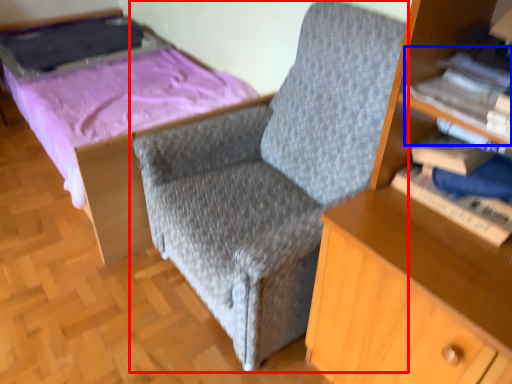
Question: Which of the following is the closest to the observer, chair (highlighted by a red box) or book (highlighted by a blue box)?

Choices:
 (A) chair
 (B) book

Answer: (A)